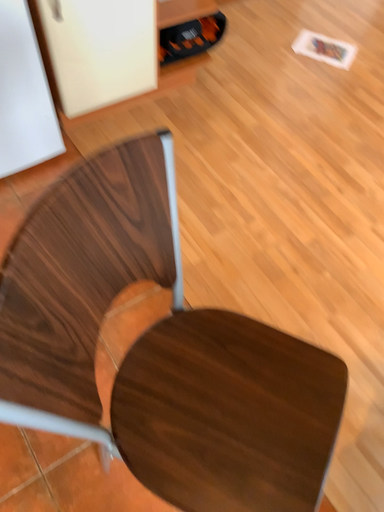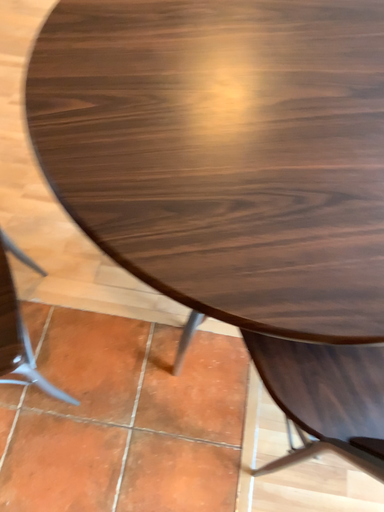
Question: How did the camera likely rotate when shooting the video?

Choices:
 (A) rotated right
 (B) rotated left

Answer: (A)